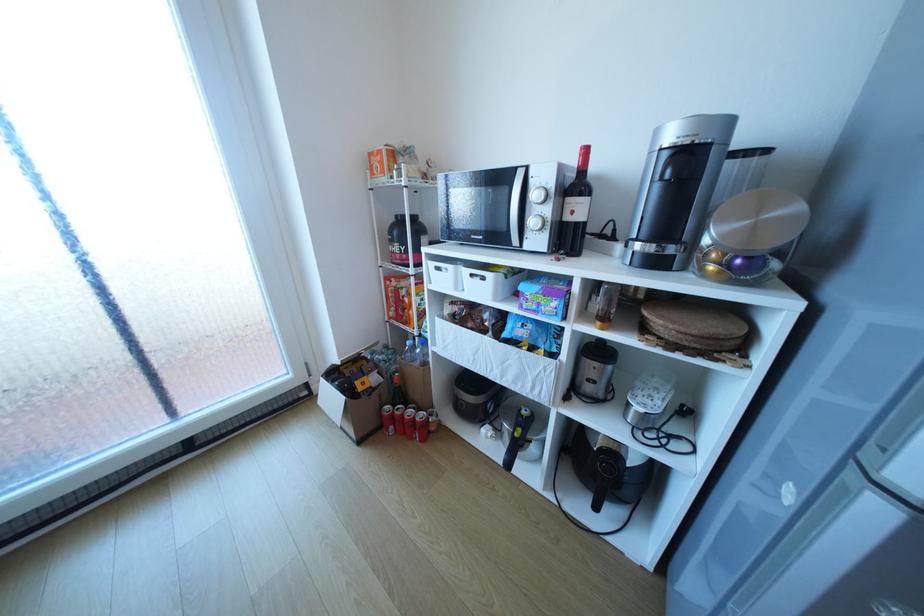
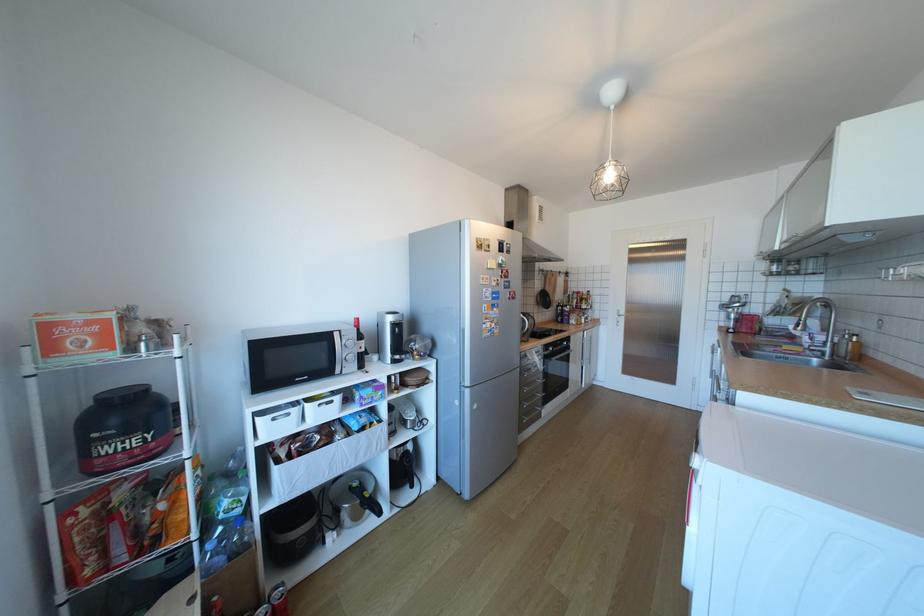
Find the pixel in the second image that matches point (605, 508) in the first image.

(420, 485)